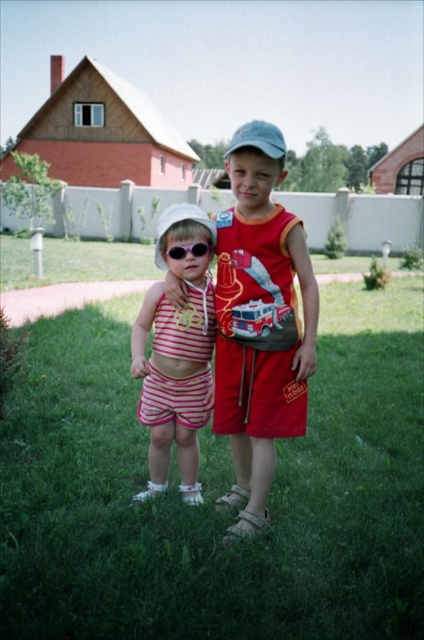
Describe the element at coordinates (259, 332) in the screenshot. The image size is (424, 640). I see `matte red shorts at center` at that location.

Does point (253, 529) lie in front of point (198, 221)?

Yes, point (253, 529) is in front of point (198, 221).

Which is in front, point (259, 278) or point (176, 218)?

Point (259, 278) is in front.

Locate an element on the screen. matte red shorts at center is located at coordinates (259, 332).

The width and height of the screenshot is (424, 640). Identify the location of matte red shorts at center. (259, 332).

Describe the element at coordinates (259, 332) in the screenshot. I see `matte red shorts at center` at that location.

Image resolution: width=424 pixels, height=640 pixels. I want to click on matte red shorts at center, so click(x=259, y=332).

Does blue fabric baseball cap at center appear over matte black sunglasses at center?

Correct, blue fabric baseball cap at center is located above matte black sunglasses at center.

Can you confirm if blue fabric baseball cap at center is bigger than matte black sunglasses at center?

Yes.

Is point (275, 138) farther from camera compared to point (178, 252)?

That is False.

You are a GUI agent. You are given a task and a screenshot of the screen. Output one action in this format:
    pyautogui.click(x=<x>, y=<y>)
    Task: Click on the blue fabric baseball cap at center
    This screenshot has width=424, height=640.
    Given the screenshot: What is the action you would take?
    coord(259,140)